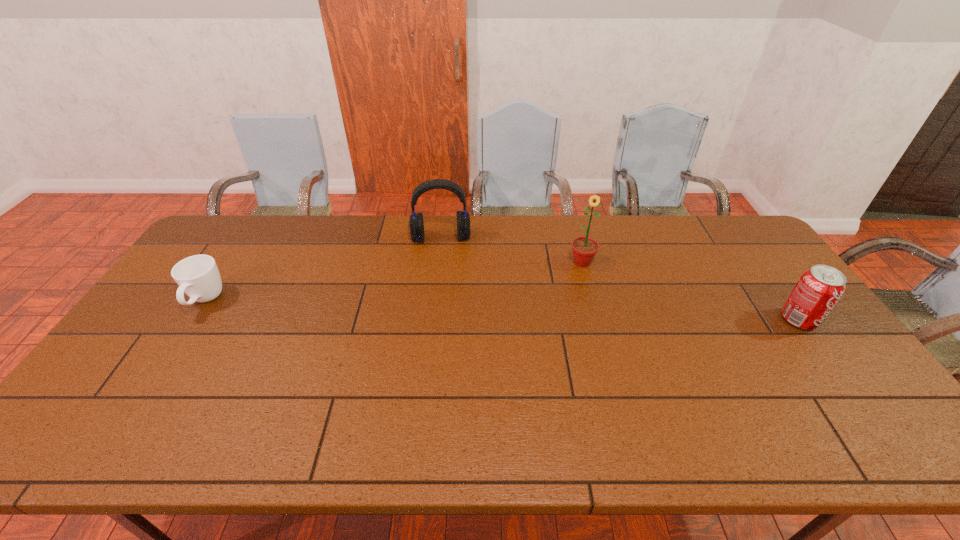
Identify the location of the leftmost object. (198, 276).

Find the location of a particular element. The height and width of the screenshot is (540, 960). cup is located at coordinates (198, 276).

Where is `the rightmost object`? Image resolution: width=960 pixels, height=540 pixels. the rightmost object is located at coordinates (x=818, y=290).

Locate an element on the screen. The width and height of the screenshot is (960, 540). the third tallest object is located at coordinates (818, 290).

This screenshot has height=540, width=960. I want to click on the farthest object, so click(416, 224).

Where is `the third shortest object`? the third shortest object is located at coordinates (416, 224).

Where is `sunflower`? Image resolution: width=960 pixels, height=540 pixels. sunflower is located at coordinates (584, 249).

The width and height of the screenshot is (960, 540). I want to click on the second object from right to left, so click(x=584, y=249).

Image resolution: width=960 pixels, height=540 pixels. What are the coordinates of `free space located 0.150m with the handle on the side of the cup` in the screenshot? It's located at [x=165, y=363].

What are the coordinates of `blank space located on the left of the third tallest object` in the screenshot? It's located at (669, 319).